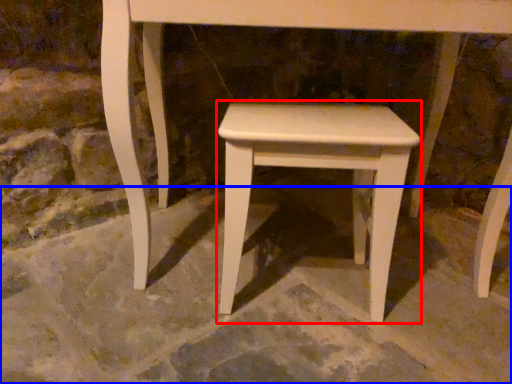
Question: Among these objects, which one is farthest to the camera, stool (highlighted by a red box) or concrete (highlighted by a blue box)?

Choices:
 (A) stool
 (B) concrete

Answer: (A)